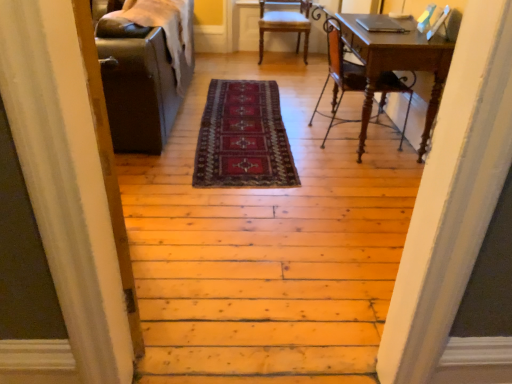
Image resolution: width=512 pixels, height=384 pixels. In order to click on free space that is in between wooden chair at right, the 1th chair positioned from the bottom, and wooden desk at right in this screenshot , I will do `click(326, 132)`.